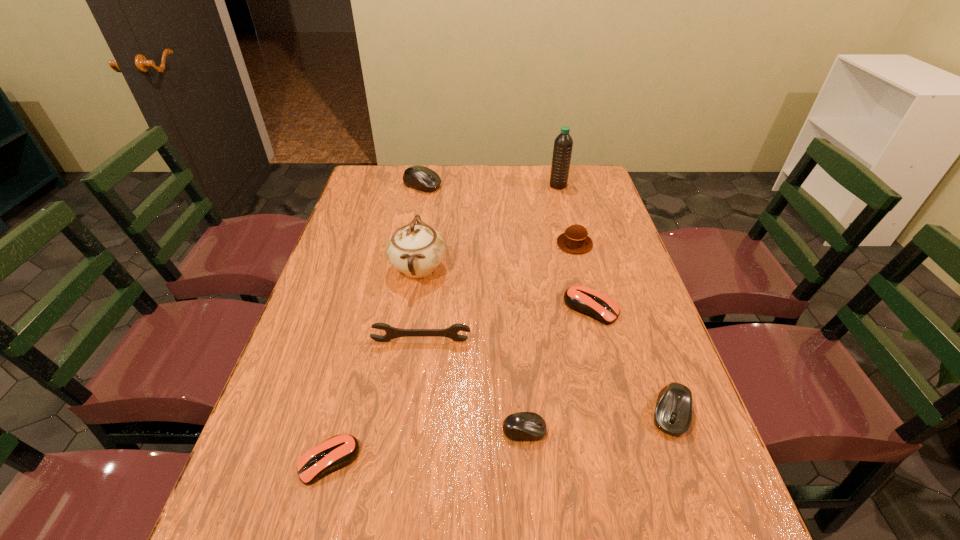
This screenshot has width=960, height=540. I want to click on unoccupied position between the fifth shortest object and the tallest object, so pos(614,299).

Where is `free spot between the second black mouse from right to left and the leftmost orange computer mouse`? This screenshot has height=540, width=960. free spot between the second black mouse from right to left and the leftmost orange computer mouse is located at coordinates (426, 446).

You are a GUI agent. You are given a task and a screenshot of the screen. Output one action in this format:
    pyautogui.click(x=<x>, y=<y>)
    Task: Click on the vacant space that's between the fifth nearest computer mouse and the biggest black mouse
    
    Given the screenshot: What is the action you would take?
    pyautogui.click(x=507, y=247)

Find the location of a particular element. free space between the rightmost black mouse and the farthest black mouse is located at coordinates (547, 299).

In order to click on object that stands as the fourth closest to the farthest black mouse in this screenshot , I will do `click(587, 301)`.

Choose which object is the fifth nearest neighbor to the fifth object from left to right. Please provide its 2D coordinates. Your answer should be formatted as a tuple, i.e. [(x, y)], where the tuple contains the x and y coordinates of a point satisfying the conditions above.

[(335, 453)]

Choose which computer mouse is the fourth nearest neighbor to the brown muffin. Please provide its 2D coordinates. Your answer should be formatted as a tuple, i.e. [(x, y)], where the tuple contains the x and y coordinates of a point satisfying the conditions above.

[(524, 426)]

You are a GUI agent. You are given a task and a screenshot of the screen. Output one action in this format:
    pyautogui.click(x=<x>, y=<y>)
    Task: Click on the fifth closest computer mouse to the fifth shortest object
    This screenshot has width=960, height=540.
    Given the screenshot: What is the action you would take?
    pyautogui.click(x=421, y=178)

The width and height of the screenshot is (960, 540). I want to click on the closest black mouse to the sixth farthest object, so click(x=524, y=426).

This screenshot has height=540, width=960. I want to click on black mouse that stands as the second closest to the leftmost orange computer mouse, so click(673, 413).